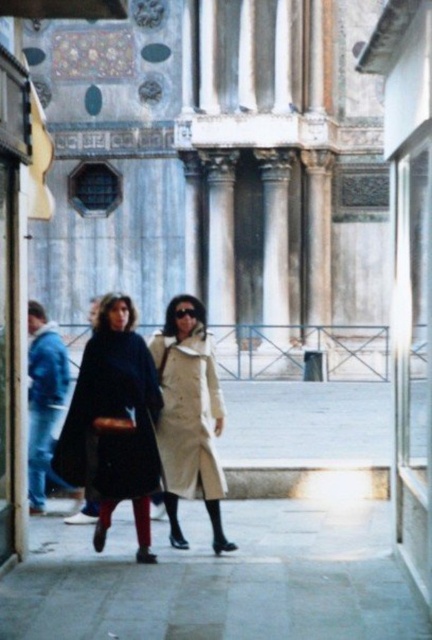
Question: Which point is closer to the camera?

Choices:
 (A) matte black cape at center
 (B) denim jacket at lower left

Answer: (A)

Question: Is matte black cape at center to the right of light beige wool coat at center from the viewer's perspective?

Choices:
 (A) yes
 (B) no

Answer: (B)

Question: Which of these objects is positioned closest to the light beige wool coat at center?

Choices:
 (A) matte black cape at center
 (B) denim jacket at lower left

Answer: (A)

Question: Does matte black cape at center appear under denim jacket at lower left?

Choices:
 (A) yes
 (B) no

Answer: (A)

Question: Based on their relative distances, which object is nearer to the denim jacket at lower left?

Choices:
 (A) matte black cape at center
 (B) light beige wool coat at center

Answer: (A)

Question: Does matte black cape at center have a lesser width compared to denim jacket at lower left?

Choices:
 (A) yes
 (B) no

Answer: (A)